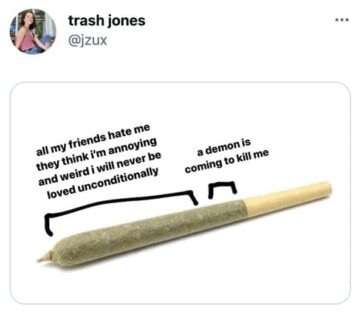
You are a GUI agent. You are given a task and a screenshot of the screen. Output one action in this format:
    pyautogui.click(x=<x>, y=<y>)
    Task: Click on the handle
    
    Given the screenshot: What is the action you would take?
    pyautogui.click(x=75, y=39)